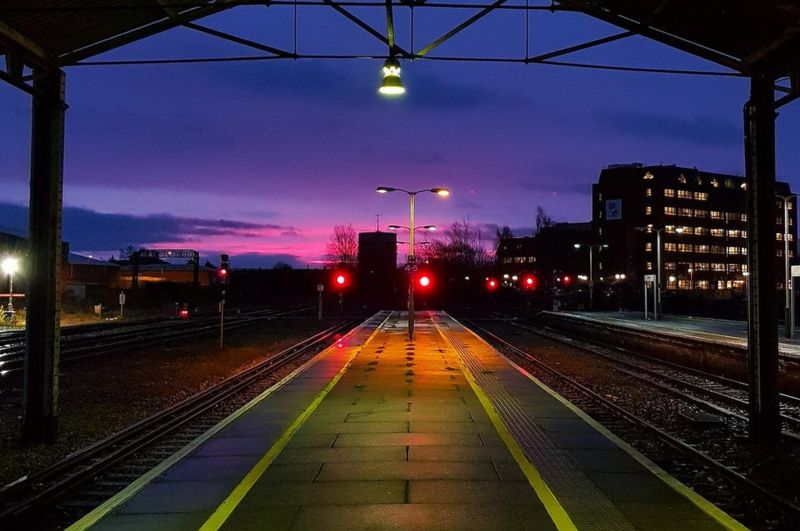
In order to click on pillar in this screenshot , I will do `click(42, 232)`, `click(761, 285)`.